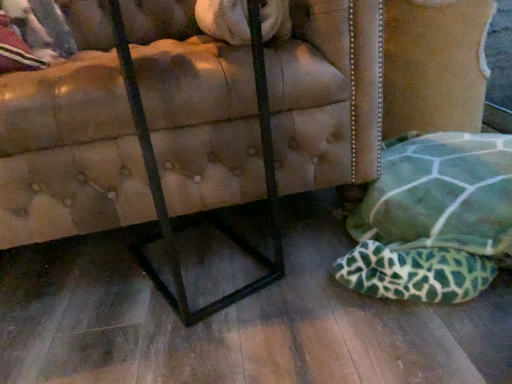
Describe the element at coordinates (433, 219) in the screenshot. I see `green fabric cushion at lower right` at that location.

Identify the location of green fabric cushion at lower right. This screenshot has height=384, width=512. (433, 219).

Locate an element on the screen. leather tufted ottoman at lower right is located at coordinates (371, 83).

This screenshot has width=512, height=384. What do you see at coordinates (371, 83) in the screenshot?
I see `leather tufted ottoman at lower right` at bounding box center [371, 83].

Identify the location of green fabric cushion at lower right. (433, 219).

Looking at this image, can you confirm if leather tufted ottoman at lower right is positioned to the right of green fabric cushion at lower right?

Incorrect, leather tufted ottoman at lower right is not on the right side of green fabric cushion at lower right.

Is leather tufted ottoman at lower right positioned before green fabric cushion at lower right?

No, it is not.

Is point (290, 173) positioned before point (419, 217)?

No, it is not.

From the image's perspective, would you say leather tufted ottoman at lower right is positioned over green fabric cushion at lower right?

Yes, from the image's perspective, leather tufted ottoman at lower right is over green fabric cushion at lower right.

From a real-world perspective, who is located higher, leather tufted ottoman at lower right or green fabric cushion at lower right?

leather tufted ottoman at lower right.

Between leather tufted ottoman at lower right and green fabric cushion at lower right, which one has smaller width?

green fabric cushion at lower right is thinner.

Who is shorter, leather tufted ottoman at lower right or green fabric cushion at lower right?

With less height is green fabric cushion at lower right.

Which of these two, leather tufted ottoman at lower right or green fabric cushion at lower right, is smaller?

Smaller between the two is green fabric cushion at lower right.

Would you say green fabric cushion at lower right is part of leather tufted ottoman at lower right's contents?

No, green fabric cushion at lower right is located outside of leather tufted ottoman at lower right.

Are leather tufted ottoman at lower right and green fabric cushion at lower right far apart?

They are positioned close to each other.

Is leather tufted ottoman at lower right turned away from green fabric cushion at lower right?

No, leather tufted ottoman at lower right is not facing the opposite direction of green fabric cushion at lower right.

The height and width of the screenshot is (384, 512). Identify the location of furniture behind the green fabric cushion at lower right. (371, 83).

Based on their positions, is green fabric cushion at lower right located to the left or right of leather tufted ottoman at lower right?

Clearly, green fabric cushion at lower right is on the right of leather tufted ottoman at lower right in the image.

Is green fabric cushion at lower right in front of or behind leather tufted ottoman at lower right in the image?

Clearly, green fabric cushion at lower right is in front of leather tufted ottoman at lower right.

Does point (465, 292) appear closer or farther from the camera than point (225, 125)?

Point (465, 292) is positioned closer to the camera compared to point (225, 125).

From the image's perspective, is green fabric cushion at lower right above leather tufted ottoman at lower right?

No.

From a real-world perspective, is green fabric cushion at lower right located higher than leather tufted ottoman at lower right?

Actually, green fabric cushion at lower right is physically below leather tufted ottoman at lower right in the real world.

Consider the image. Considering the sizes of green fabric cushion at lower right and leather tufted ottoman at lower right in the image, is green fabric cushion at lower right wider or thinner than leather tufted ottoman at lower right?

Considering their sizes, green fabric cushion at lower right looks slimmer than leather tufted ottoman at lower right.

Is green fabric cushion at lower right shorter than leather tufted ottoman at lower right?

Indeed, green fabric cushion at lower right has a lesser height compared to leather tufted ottoman at lower right.

Is green fabric cushion at lower right smaller than leather tufted ottoman at lower right?

Indeed, green fabric cushion at lower right has a smaller size compared to leather tufted ottoman at lower right.

Would you say green fabric cushion at lower right is inside or outside leather tufted ottoman at lower right?

green fabric cushion at lower right is outside leather tufted ottoman at lower right.

Is the surface of green fabric cushion at lower right in direct contact with leather tufted ottoman at lower right?

They are not placed beside each other.

Looking at this image, does green fabric cushion at lower right turn towards leather tufted ottoman at lower right?

No, green fabric cushion at lower right is not facing towards leather tufted ottoman at lower right.

How different are the orientations of green fabric cushion at lower right and leather tufted ottoman at lower right in degrees?

5.84 degrees.

How much distance is there between green fabric cushion at lower right and leather tufted ottoman at lower right?

They are 11.29 inches apart.

In order to click on furniture behind the green fabric cushion at lower right in this screenshot , I will do `click(371, 83)`.

This screenshot has height=384, width=512. In order to click on furniture behind the green fabric cushion at lower right in this screenshot , I will do `click(371, 83)`.

The image size is (512, 384). What are the coordinates of `furniture positioned vertically above the green fabric cushion at lower right (from a real-world perspective)` in the screenshot? It's located at [x=371, y=83].